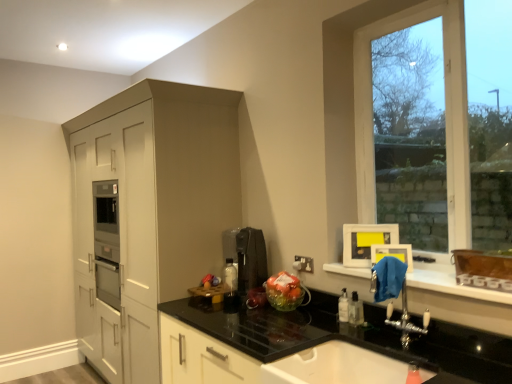
Question: Considering the positions of black granite countertop at center and clear glass window at upper right in the image, is black granite countertop at center taller or shorter than clear glass window at upper right?

Choices:
 (A) short
 (B) tall

Answer: (A)

Question: Would you say black granite countertop at center is to the left or to the right of clear glass window at upper right in the picture?

Choices:
 (A) right
 (B) left

Answer: (B)

Question: Estimate the real-world distances between objects in this image. Which object is farther from the clear plastic bottle at lower right?

Choices:
 (A) black plastic coffee machine at center
 (B) black granite countertop at center
 (C) white glossy sink at lower center
 (D) matte white cabinet at left
 (E) clear glass window at upper right

Answer: (D)

Question: Which of these objects is positioned closest to the blue fabric at lower right?

Choices:
 (A) matte white cabinet at left
 (B) clear plastic bottle at lower right
 (C) black plastic coffee machine at center
 (D) black granite countertop at center
 (E) white glossy sink at lower center

Answer: (D)